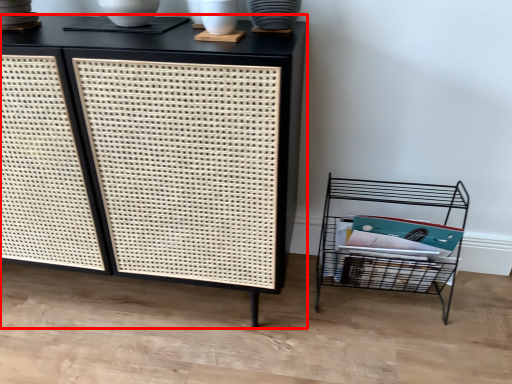
Question: From the image's perspective, where is furniture (annotated by the red box) located relative to shelf?

Choices:
 (A) above
 (B) below

Answer: (A)